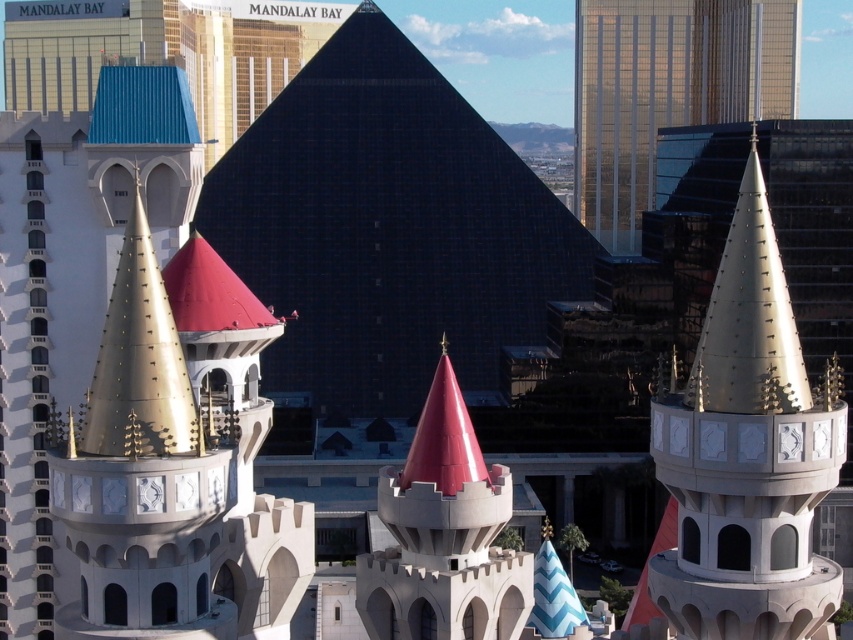
Question: Which of the following is the closest to the observer?

Choices:
 (A) (373, 300)
 (B) (751, 84)
 (C) (723, 352)

Answer: (C)

Question: Observing the image, what is the correct spatial positioning of black glass pyramid at center in reference to gold metallic spire at left?

Choices:
 (A) above
 (B) below

Answer: (B)

Question: Among these points, which one is nearest to the camera?

Choices:
 (A) (740, 24)
 (B) (728, 240)
 (C) (781, 472)

Answer: (C)

Question: Which point is farther from the camera taking this photo?

Choices:
 (A) (186, 381)
 (B) (824, 483)
 (C) (416, 138)

Answer: (C)

Question: Does black glass pyramid at center come in front of smooth red cone at center?

Choices:
 (A) yes
 (B) no

Answer: (B)

Question: In this image, where is gold metallic spire at center located relative to gold reflective spire at center?

Choices:
 (A) above
 (B) below

Answer: (B)